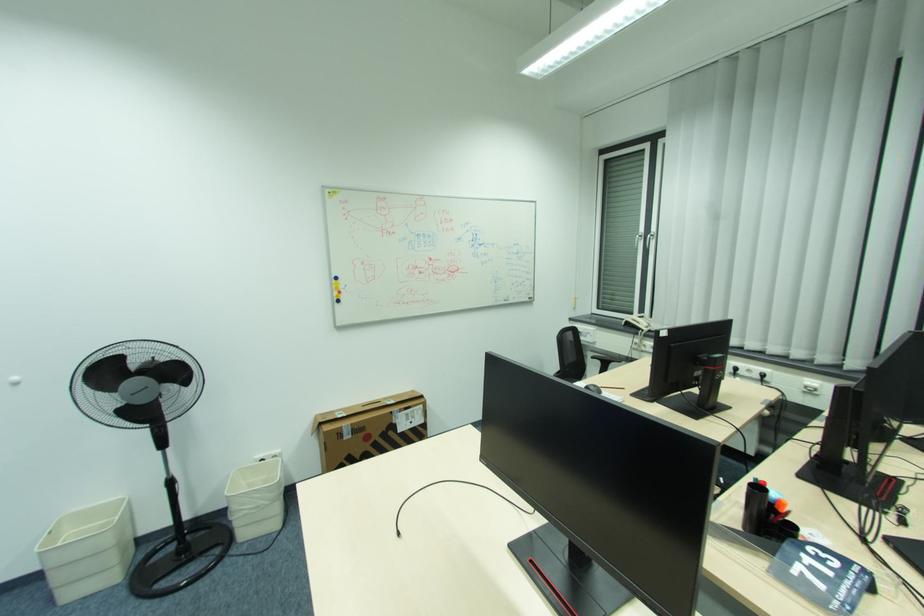
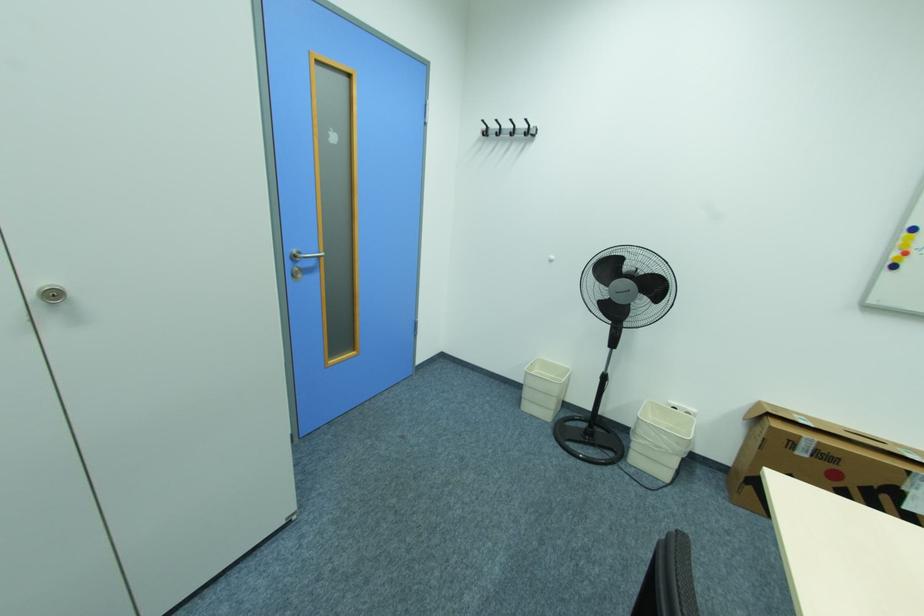
Where in the second image is the point corresponding to (346,427) from the first image?

(805, 437)